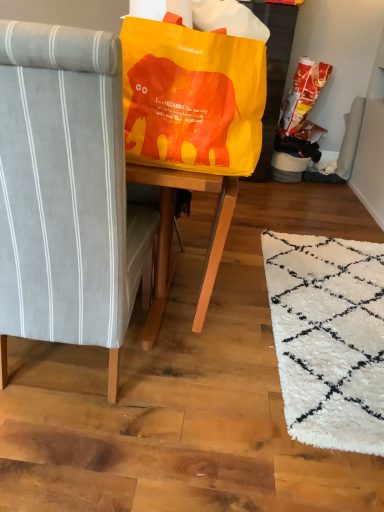
What are the coordinates of `vacant region in front of gray fabric chair at left` in the screenshot? It's located at (85, 454).